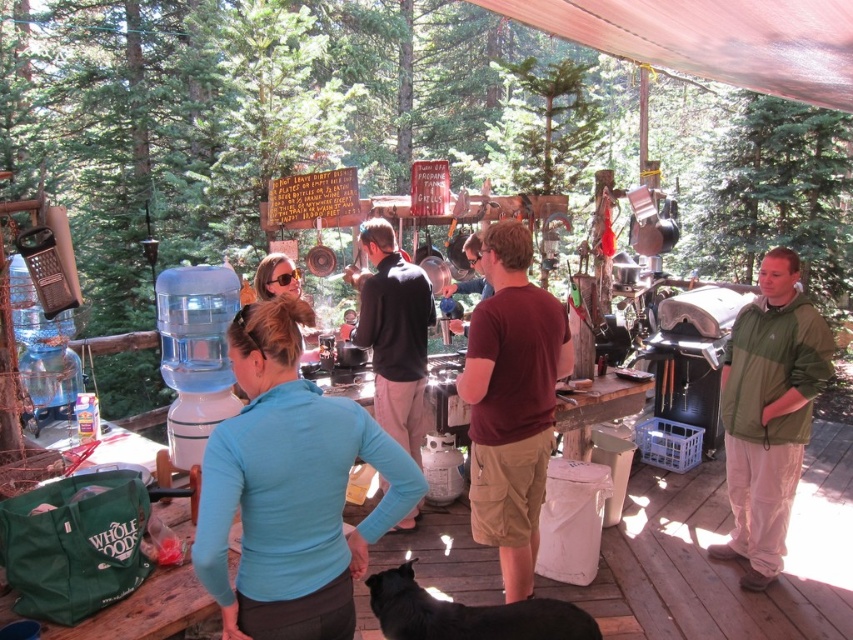
Question: Based on their relative distances, which object is farther from the maroon cotton t-shirt at center?

Choices:
 (A) dark brown leather jacket at center
 (B) wooden deck at center
 (C) green fabric jacket at right

Answer: (C)

Question: Does blue fabric shirt at center have a larger size compared to dark brown leather jacket at center?

Choices:
 (A) no
 (B) yes

Answer: (A)

Question: Which of the following is the farthest from the observer?

Choices:
 (A) (793, 332)
 (B) (386, 333)

Answer: (B)

Question: Considering the real-world distances, which object is closest to the maroon cotton t-shirt at center?

Choices:
 (A) blue fabric shirt at center
 (B) dark brown leather jacket at center
 (C) wooden deck at center

Answer: (B)

Question: Does blue fabric shirt at center appear under dark brown leather jacket at center?

Choices:
 (A) no
 (B) yes

Answer: (B)

Question: Can you confirm if green fabric jacket at right is positioned to the left of dark brown leather jacket at center?

Choices:
 (A) yes
 (B) no

Answer: (B)